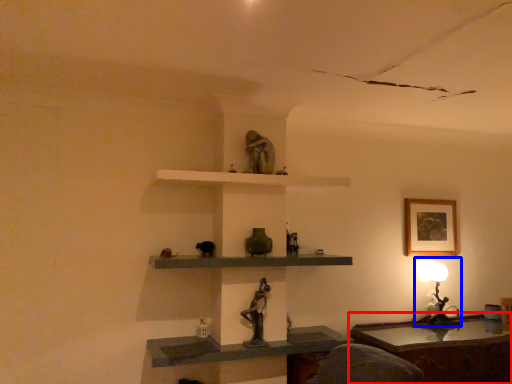
Question: Which object appears closest to the camera in this image, table (highlighted by a red box) or table lamp (highlighted by a blue box)?

Choices:
 (A) table
 (B) table lamp

Answer: (A)